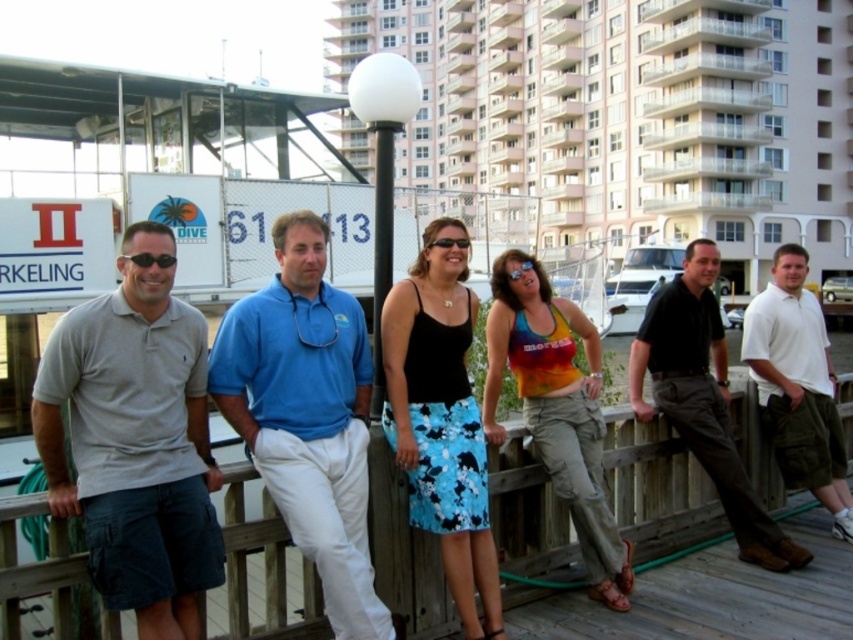
You are a photographer trying to capture a clear shot of the dark brown leather pants at right and the white cotton polo shirt at right. Since they are overlapping, which one is covering part of the other?

The dark brown leather pants at right is positioned over white cotton polo shirt at right, so the dark brown leather pants at right is covering part of the white cotton polo shirt at right.

You are a photographer standing on the wooden dock. You want to capture a photo that includes both the wooden at left and the dark brown leather pants at right. Given that your camera has a maximum zoom range of 3 meters, can you frame both objects in the same shot without moving your position?

The distance between the wooden at left and the dark brown leather pants at right is 5.19 meters. Since your camera can only zoom up to 3 meters, you cannot frame both objects in the same shot without moving your position.

You are planning to place a rectangular object that is 1.5 meters wide between the wooden at left and the dark brown leather pants at right. Based on the scene description, will there be enough space for the object to fit without overlapping either of them?

The wooden at left has a lesser width compared to dark brown leather pants at right, so the space between them might be sufficient. However, since the exact distance isn not provided, it is uncertain if the 1.5 meter object will fit without overlapping.